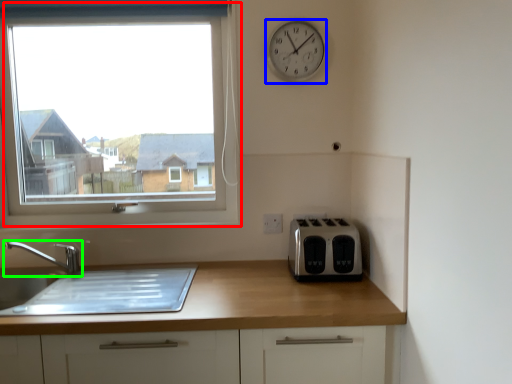
Question: Which object is positioned closest to window (highlighted by a red box)? Select from clock (highlighted by a blue box) and tap (highlighted by a green box).

Choices:
 (A) clock
 (B) tap

Answer: (B)